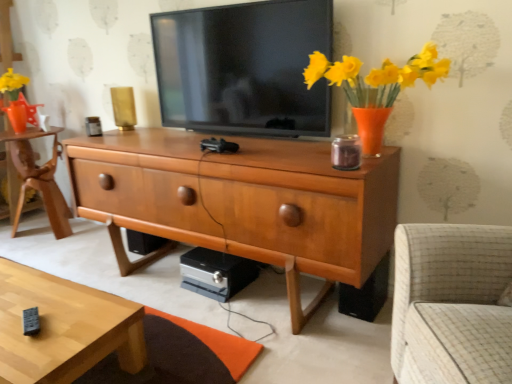
Find the location of a particular element. black plastic speaker at lower right is located at coordinates (366, 293).

In order to click on matte black tv at center in this screenshot , I will do click(243, 68).

This screenshot has width=512, height=384. What do you see at coordinates (64, 328) in the screenshot?
I see `light wood/texture coffee table at lower left` at bounding box center [64, 328].

Locate an element on the screen. black plastic speaker at lower right is located at coordinates (366, 293).

Which of these two, light brown wooden desk at left or light wood/texture coffee table at lower left, stands taller?

With more height is light brown wooden desk at left.

Based on the photo, is light brown wooden desk at left bigger or smaller than light wood/texture coffee table at lower left?

Clearly, light brown wooden desk at left is larger in size than light wood/texture coffee table at lower left.

In the scene shown: From the image's perspective, is light brown wooden desk at left on top of light wood/texture coffee table at lower left?

Yes, from the image's perspective, light brown wooden desk at left is on top of light wood/texture coffee table at lower left.

Considering the points (53, 156) and (42, 373), which point is in front, point (53, 156) or point (42, 373)?

The point (42, 373) is in front.

You are a GUI agent. You are given a task and a screenshot of the screen. Output one action in this format:
    pyautogui.click(x=<x>, y=<y>)
    Task: Click on the speaker behind the wooden chest of drawers at center
    
    Given the screenshot: What is the action you would take?
    pyautogui.click(x=366, y=293)

Is black plastic speaker at lower right smaller than wooden chest of drawers at center?

Correct, black plastic speaker at lower right occupies less space than wooden chest of drawers at center.

Can you confirm if black plastic speaker at lower right is taller than wooden chest of drawers at center?

In fact, black plastic speaker at lower right may be shorter than wooden chest of drawers at center.

Considering the relative sizes of black plastic speaker at lower right and light brown wooden desk at left in the image provided, is black plastic speaker at lower right thinner than light brown wooden desk at left?

Correct, the width of black plastic speaker at lower right is less than that of light brown wooden desk at left.

Is black plastic speaker at lower right situated inside light brown wooden desk at left or outside?

The correct answer is: outside.

From the image's perspective, would you say black plastic speaker at lower right is shown under light brown wooden desk at left?

Yes, from the image's perspective, black plastic speaker at lower right is beneath light brown wooden desk at left.

Is black plastic speaker at lower right aimed at light brown wooden desk at left?

No.

Are wooden chest of drawers at center and light brown wooden desk at left making contact?

No.

Between wooden chest of drawers at center and light brown wooden desk at left, which one has more height?

Standing taller between the two is wooden chest of drawers at center.

From the image's perspective, which object appears higher, wooden chest of drawers at center or light brown wooden desk at left?

From the image's view, light brown wooden desk at left is above.

Identify the location of chest of drawers in front of the light brown wooden desk at left. This screenshot has height=384, width=512. (241, 202).

From a real-world perspective, is light brown wooden desk at left physically above wooden chest of drawers at center?

No.

Can you confirm if light brown wooden desk at left is bigger than wooden chest of drawers at center?

No.

Is light brown wooden desk at left not within wooden chest of drawers at center?

light brown wooden desk at left lies outside wooden chest of drawers at center's area.

How different are the orientations of light brown wooden desk at left and wooden chest of drawers at center in degrees?

1.14 degrees.

Between point (67, 149) and point (278, 122), which one is positioned behind?

The point (67, 149) is farther from the camera.

In the scene shown: Would you say wooden chest of drawers at center is to the left or to the right of matte black tv at center in the picture?

wooden chest of drawers at center is to the left of matte black tv at center.

From a real-world perspective, is wooden chest of drawers at center located higher than matte black tv at center?

No, from a real-world perspective, wooden chest of drawers at center is not over matte black tv at center

From the image's perspective, which object appears higher, wooden chest of drawers at center or matte black tv at center?

matte black tv at center.

From the picture: Considering the relative positions of wooden chest of drawers at center and light wood/texture coffee table at lower left in the image provided, is wooden chest of drawers at center to the left of light wood/texture coffee table at lower left from the viewer's perspective?

In fact, wooden chest of drawers at center is to the right of light wood/texture coffee table at lower left.

Which of these two, wooden chest of drawers at center or light wood/texture coffee table at lower left, is smaller?

Smaller between the two is light wood/texture coffee table at lower left.

Is wooden chest of drawers at center completely or partially outside of light wood/texture coffee table at lower left?

Yes, wooden chest of drawers at center is located beyond the bounds of light wood/texture coffee table at lower left.

Does wooden chest of drawers at center lie behind light wood/texture coffee table at lower left?

Yes, wooden chest of drawers at center is further from the viewer.

In the image, there is a light wood/texture coffee table at lower left. Identify the location of desk above it (from the image's perspective). (39, 178).

You are a GUI agent. You are given a task and a screenshot of the screen. Output one action in this format:
    pyautogui.click(x=<x>, y=<y>)
    Task: Click on the speaker on the right of wooden chest of drawers at center
    This screenshot has height=384, width=512.
    Given the screenshot: What is the action you would take?
    pyautogui.click(x=366, y=293)

From the picture: From the image, which object appears to be nearer to light brown wooden desk at left, light wood/texture coffee table at lower left or wooden chest of drawers at center?

The object closer to light brown wooden desk at left is wooden chest of drawers at center.

Based on their spatial positions, is wooden chest of drawers at center or matte black tv at center closer to light brown wooden desk at left?

wooden chest of drawers at center is closer to light brown wooden desk at left.

Considering their positions, is matte black tv at center positioned further to light brown wooden desk at left than black plastic speaker at lower right?

black plastic speaker at lower right.

Estimate the real-world distances between objects in this image. Which object is closer to light brown wooden desk at left, black plastic speaker at lower right or light wood/texture coffee table at lower left?

Among the two, light wood/texture coffee table at lower left is located nearer to light brown wooden desk at left.

When comparing their distances from matte black tv at center, does light brown wooden desk at left or wooden chest of drawers at center seem further?

light brown wooden desk at left.

Considering their positions, is light wood/texture coffee table at lower left positioned closer to black plastic speaker at lower right than matte black tv at center?

matte black tv at center is positioned closer to the anchor black plastic speaker at lower right.

Which object lies nearer to the anchor point light wood/texture coffee table at lower left, wooden chest of drawers at center or light brown wooden desk at left?

The object closer to light wood/texture coffee table at lower left is wooden chest of drawers at center.

Consider the image. From the image, which object appears to be farther from wooden chest of drawers at center, black plastic speaker at lower right or matte black tv at center?

black plastic speaker at lower right is further to wooden chest of drawers at center.

Where is `coffee table between light brown wooden desk at left and matte black tv at center in the horizontal direction`? coffee table between light brown wooden desk at left and matte black tv at center in the horizontal direction is located at coordinates (64, 328).

Image resolution: width=512 pixels, height=384 pixels. Identify the location of the chest of drawers that lies between matte black tv at center and black plastic speaker at lower right from top to bottom. (241, 202).

Where is `coffee table situated between light brown wooden desk at left and black plastic speaker at lower right from left to right`? This screenshot has height=384, width=512. coffee table situated between light brown wooden desk at left and black plastic speaker at lower right from left to right is located at coordinates (64, 328).

Identify the location of the chest of drawers situated between light brown wooden desk at left and black plastic speaker at lower right from left to right. (241, 202).